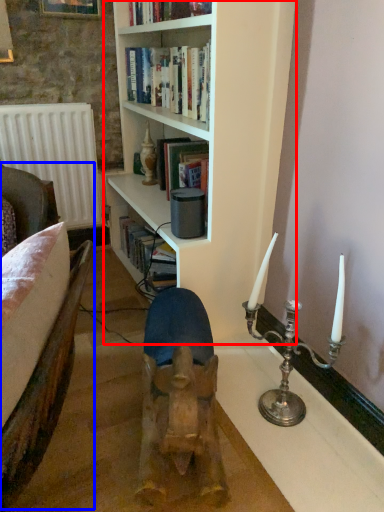
Question: Which object appears closest to the camera in this image, bookcase (highlighted by a red box) or armchair (highlighted by a blue box)?

Choices:
 (A) bookcase
 (B) armchair

Answer: (B)